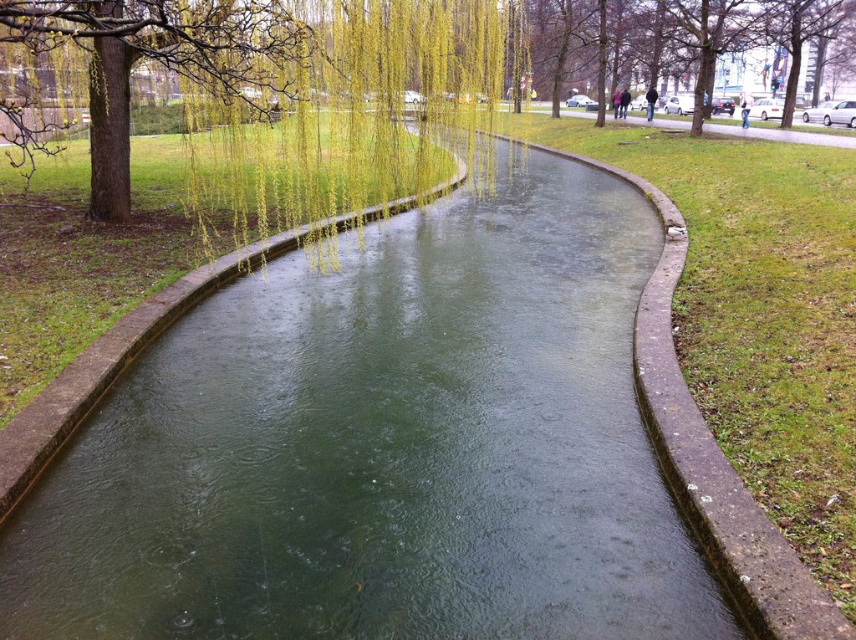
Can you confirm if yellow-green leafy willow at upper left is wider than brown textured tree at upper center?

Indeed, yellow-green leafy willow at upper left has a greater width compared to brown textured tree at upper center.

Can you confirm if yellow-green leafy willow at upper left is positioned to the left of brown textured tree at upper center?

Correct, you'll find yellow-green leafy willow at upper left to the left of brown textured tree at upper center.

The height and width of the screenshot is (640, 856). What do you see at coordinates (351, 115) in the screenshot?
I see `yellow-green leafy willow at upper left` at bounding box center [351, 115].

This screenshot has height=640, width=856. I want to click on yellow-green leafy willow at upper left, so click(351, 115).